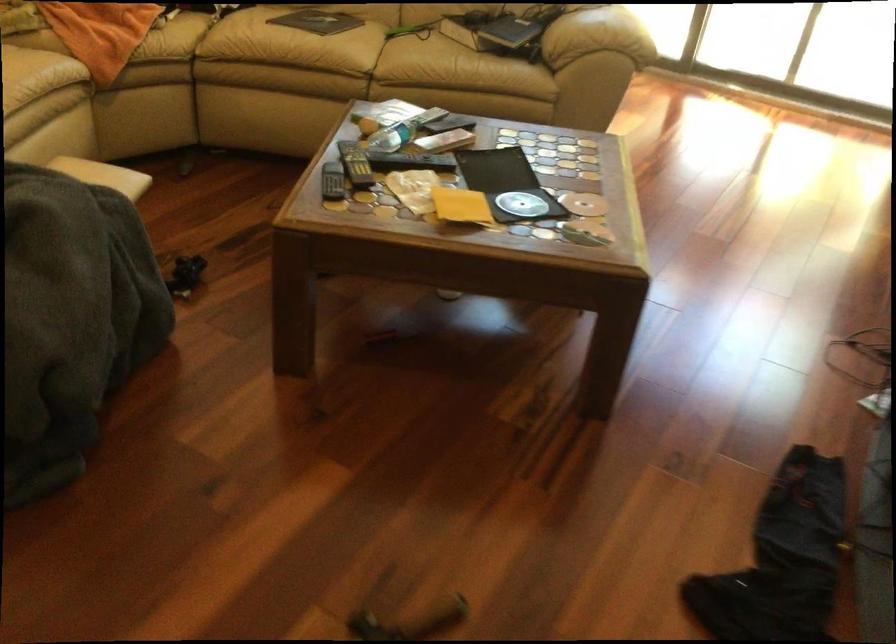
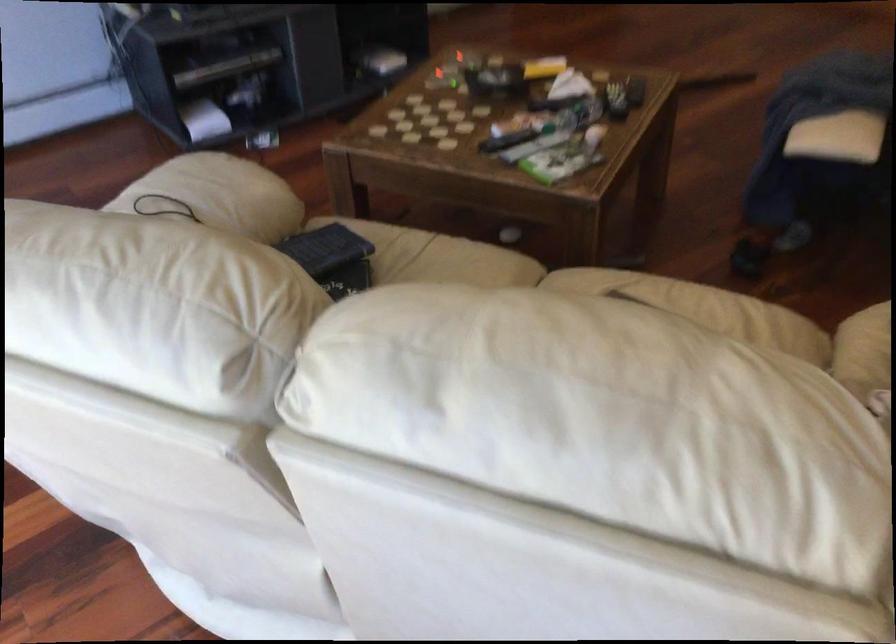
Question: I am providing you with two images of the same scene from different viewpoints. After the viewpoint changes to image2, which objects are now occluded?

Choices:
 (A) blue book
 (B) white sofa sitting surface
 (C) white perforated tray
 (D) green game case

Answer: (A)